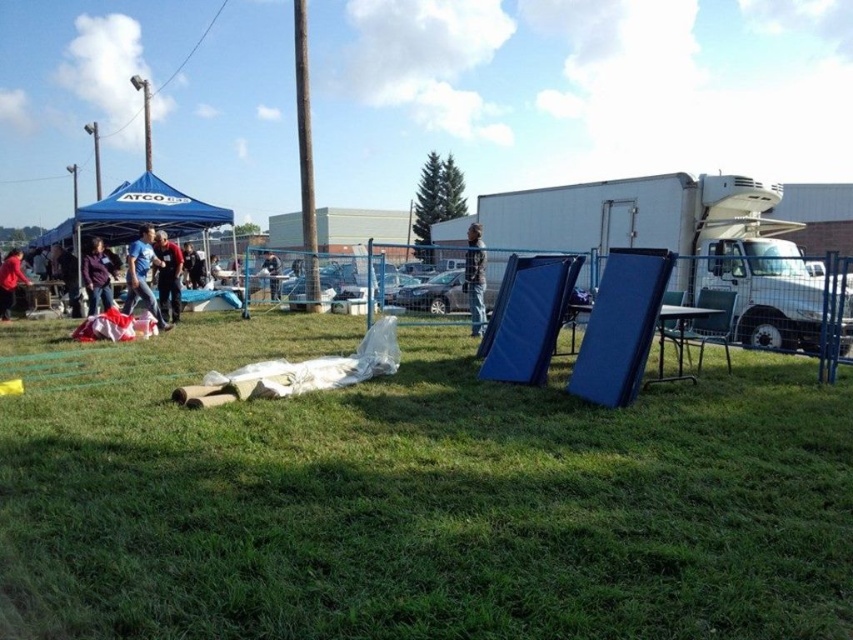
You are standing at the blue tent with ATCO written on its canopy. You see two points in the scene, point (672, 340) and point (137, 252). Which point is closer to you?

Point (672, 340) is closer to you than point (137, 252).

You are setting up chairs for an event. You have a blue plastic chair at center and a green plastic chair at center. Which chair has a narrower width?

The blue plastic chair at center is thinner than the green plastic chair at center, so the blue plastic chair at center has a narrower width.

You are standing in the outdoor setting and see the blue fabric at left and the red shirt at center. Which object is taller?

The blue fabric at left is taller than the red shirt at center.